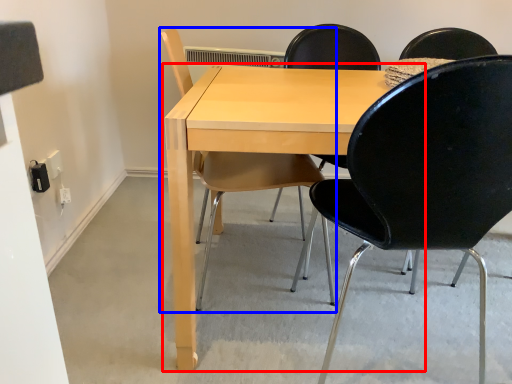
Question: Which point is further to the camera, table (highlighted by a red box) or chair (highlighted by a blue box)?

Choices:
 (A) table
 (B) chair

Answer: (B)